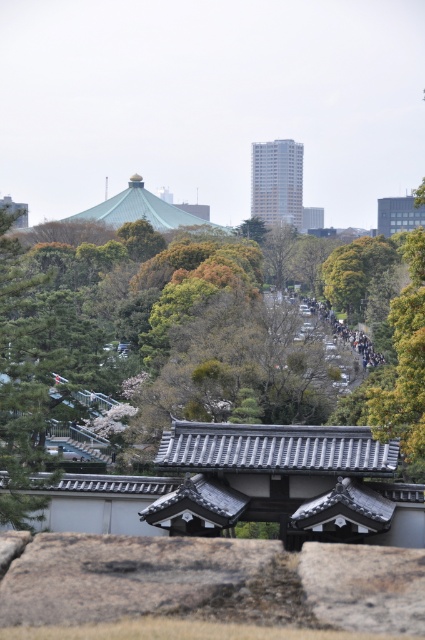
You are standing at the entrance of the park and see the green leafy tree at center and the matte gray stone temple at upper center. Which object is located to the left of the other?

The green leafy tree at center is positioned on the left side of matte gray stone temple at upper center.

You are standing in a park with a temple in the background. There is a point marked at coordinates [277,180]. What is located at that point?

The point at [277,180] is where the matte gray temple at upper center is located.